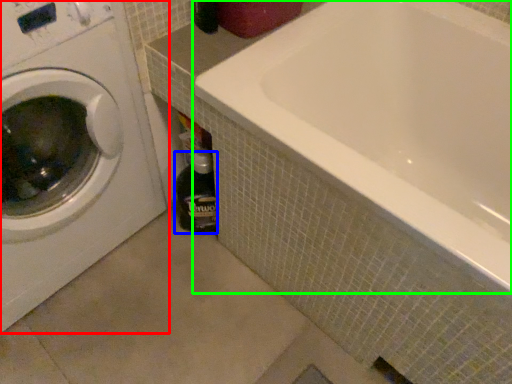
Question: Based on their relative distances, which object is nearer to washing machine (highlighted by a red box)? Choose from bottle (highlighted by a blue box) and bathtub (highlighted by a green box).

Choices:
 (A) bottle
 (B) bathtub

Answer: (A)